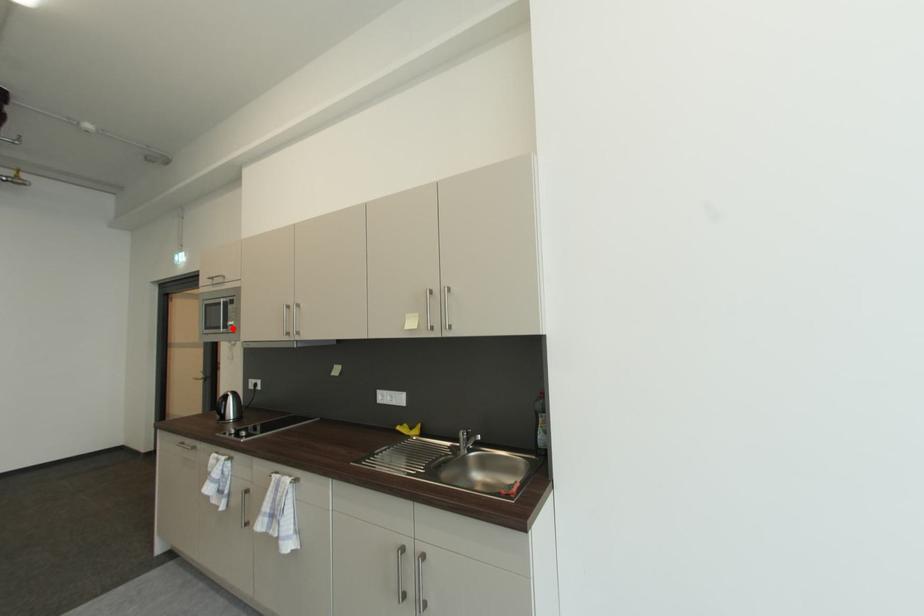
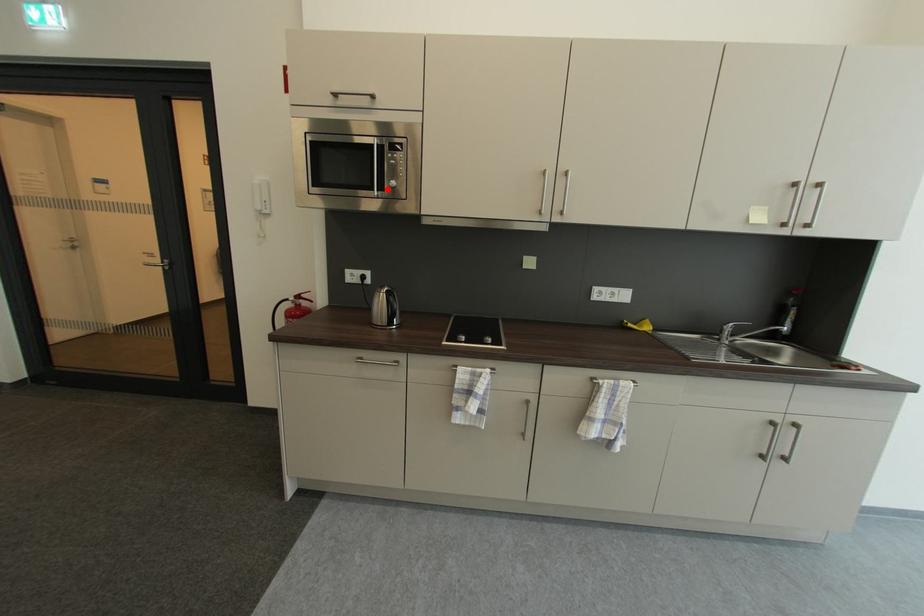
I am providing you with two images of the same scene from different viewpoints. A red point is marked on the first image and another point is marked on the second image. Does the point marked in image1 correspond to the same location as the one in image2?

Yes